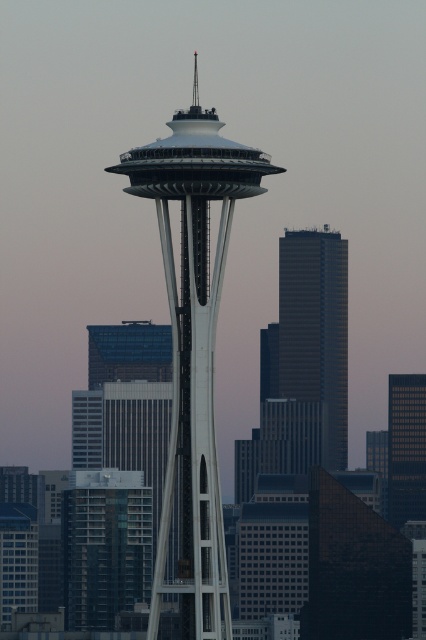
You are an architect analyzing the Seattle skyline. You observe the white glass tower at center and the smooth glass skyscraper at right. Which one is positioned higher in the image?

The white glass tower at center is positioned higher than the smooth glass skyscraper at right in the image.

Based on the scene description, where is the dark gray glass skyscraper at center located in the image? Please provide its coordinates as a point in the format of a tuple with two decimal numbers between 0 and 1, where the first number represents the horizontal axis and the second the vertical axis. If you cannot determine the coordinates, respond with an empty tuple. The answer should be in the following format, for example, if the coordinates are 0.5 and 0.6, you should write the tuple as 0.5,0.6. If you,

The dark gray glass skyscraper at center is located at point coordinates (316, 328).

You are a drone operator planning to fly a drone between the white glass tower at center and the dark gray glass skyscraper at center. According to the scene description, which object is positioned higher in the image?

The white glass tower at center is located above the dark gray glass skyscraper at center, so it is positioned higher in the image.